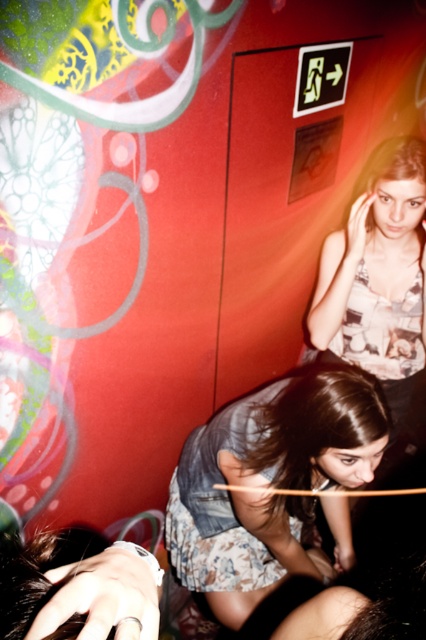
You are at a party and want to take a photo of both the denim jacket at lower center and the matte floral tank top at upper right. Which object should you focus on first to ensure both are in frame?

The denim jacket at lower center is to the left of the matte floral tank top at upper right, so you should focus on the denim jacket at lower center first to ensure both are in frame.

You are a photographer at the event and want to capture a photo that includes both the denim jacket at lower center and the matte floral tank top at upper right. Based on their positions, which one should you focus on first to ensure both are in frame?

The denim jacket at lower center is below the matte floral tank top at upper right, so you should focus on the matte floral tank top at upper right first to ensure both are in frame.

In the scene shown: You are standing in the club scene described. There is a point at coordinates (270, 483). What object is located at that point?

The point at coordinates (270, 483) corresponds to the denim jacket at lower center.